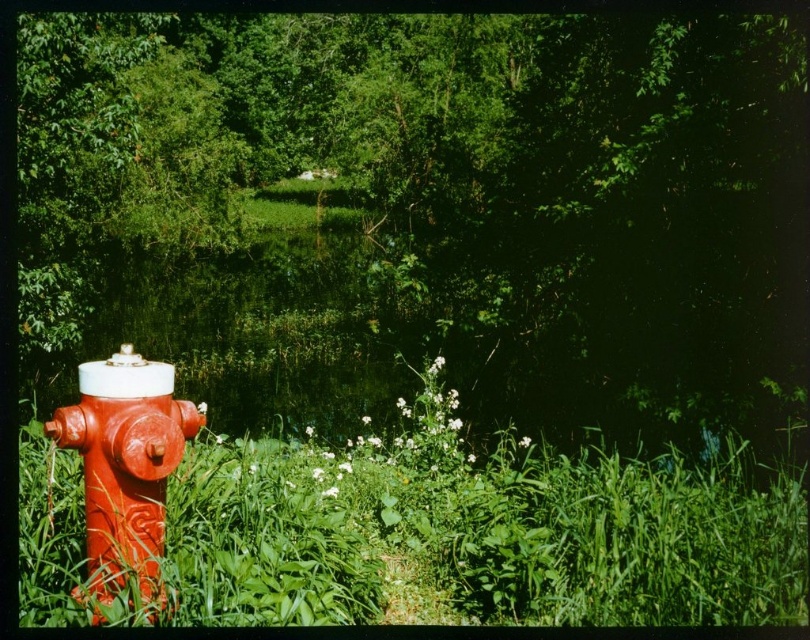
You are standing in the outdoor scene and want to walk from point A to point B. Point A is at coordinates point (482, 339) and point B is at coordinates point (143, 396). Which point is closer to you when you start walking?

Point (482, 339) is further to the viewer than point (143, 396), so point B is closer to you when you start walking.

In the scene shown: You are a gardener who wants to water plants near the shiny red fire hydrant at left. To reach it, you need to walk around the green leafy tree at left. Which direction should you walk around the tree to get to the hydrant?

The shiny red fire hydrant at left is behind the green leafy tree at left, so you should walk around the tree towards the right side to reach the hydrant.

You are standing at the point marked by the coordinates point (x=553, y=244). What object are you facing?

The point (x=553, y=244) marks green leafy tree at left, so you are facing the green leafy tree at left.